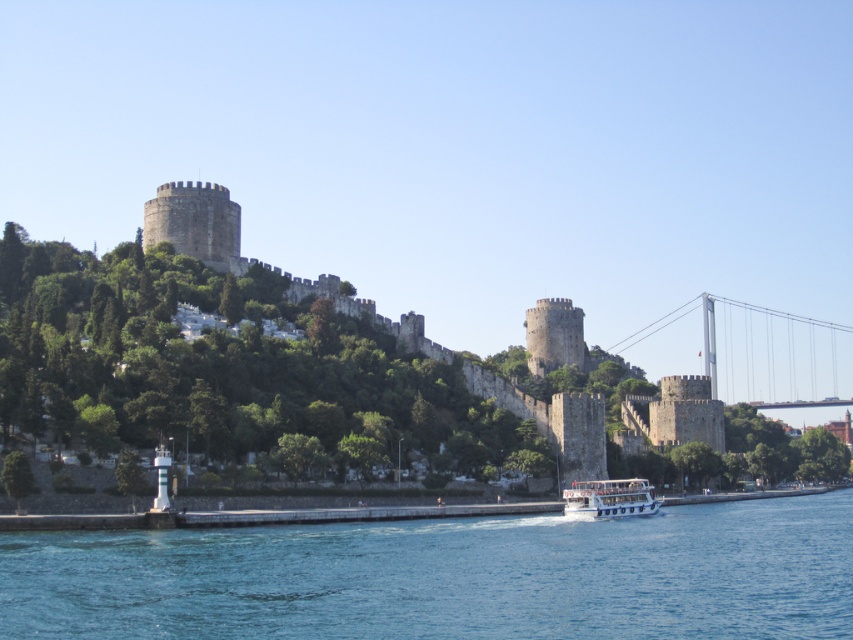
Measure the distance between stone wall at center and metallic gray bridge at right.

A distance of 55.61 meters exists between stone wall at center and metallic gray bridge at right.

Is stone wall at center smaller than metallic gray bridge at right?

No.

Does point (146, 208) come closer to viewer compared to point (746, 342)?

Yes, point (146, 208) is in front of point (746, 342).

The width and height of the screenshot is (853, 640). Identify the location of stone wall at center. click(x=490, y=385).

Which is behind, point (740, 378) or point (602, 492)?

The point (740, 378) is behind.

At what (x,y) coordinates should I click in order to perform the action: click on metallic gray bridge at right. Please return your answer as a coordinate pair (x, y). The height and width of the screenshot is (640, 853). Looking at the image, I should click on (762, 353).

Can you confirm if blue water at lower center is positioned to the right of white glossy boat at lower center?

No, blue water at lower center is not to the right of white glossy boat at lower center.

The width and height of the screenshot is (853, 640). What do you see at coordinates (448, 577) in the screenshot? I see `blue water at lower center` at bounding box center [448, 577].

Image resolution: width=853 pixels, height=640 pixels. Describe the element at coordinates (448, 577) in the screenshot. I see `blue water at lower center` at that location.

This screenshot has height=640, width=853. Find the location of `blue water at lower center`. blue water at lower center is located at coordinates (448, 577).